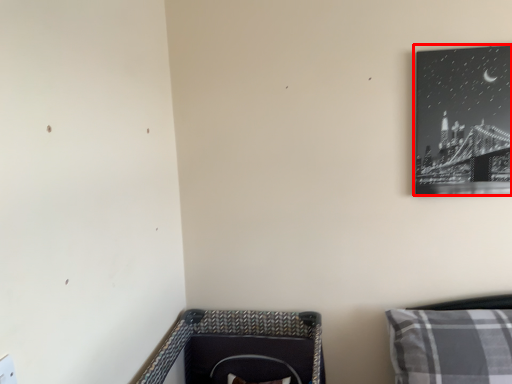
Question: From the image's perspective, where is picture frame (annotated by the red box) located in relation to pillow in the image?

Choices:
 (A) below
 (B) above

Answer: (B)